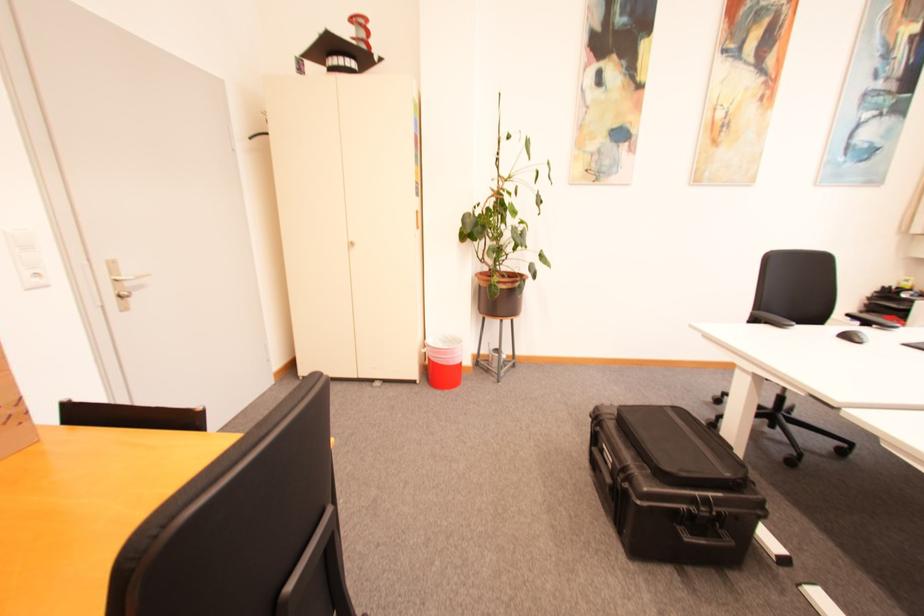
Find where to push the white light switch. Please return your answer as a coordinate pair (x, y).

(30, 261)